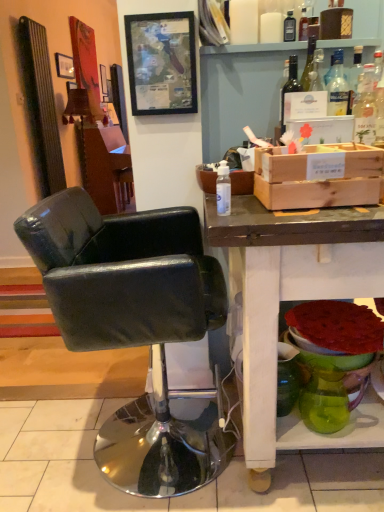
Question: Is wooden framed map at upper center, which is the first picture frame from front to back, to the right of wooden crate at right from the viewer's perspective?

Choices:
 (A) yes
 (B) no

Answer: (B)

Question: From the image's perspective, would you say wooden framed map at upper center, acting as the second picture frame starting from the left, is positioned over wooden crate at right?

Choices:
 (A) no
 (B) yes

Answer: (B)

Question: From the image's perspective, is wooden framed map at upper center, arranged as the 2th picture frame when viewed from the top, beneath wooden crate at right?

Choices:
 (A) no
 (B) yes

Answer: (A)

Question: Is the surface of wooden framed map at upper center, acting as the second picture frame starting from the left, in direct contact with wooden crate at right?

Choices:
 (A) yes
 (B) no

Answer: (B)

Question: Is there a large distance between wooden framed map at upper center, which appears as the 1th picture frame when viewed from the right, and wooden crate at right?

Choices:
 (A) no
 (B) yes

Answer: (A)

Question: From a real-world perspective, is wooden framed map at upper center, arranged as the 2th picture frame when viewed from the top, under wooden crate at right?

Choices:
 (A) no
 (B) yes

Answer: (A)

Question: Considering the relative sizes of transparent glass bottle at upper center, the 3th bottle from the bottom, and green glass vase at lower right in the image provided, is transparent glass bottle at upper center, the 3th bottle from the bottom, wider than green glass vase at lower right?

Choices:
 (A) no
 (B) yes

Answer: (A)

Question: Considering the relative sizes of transparent glass bottle at upper center, the 3th bottle from the bottom, and green glass vase at lower right in the image provided, is transparent glass bottle at upper center, the 3th bottle from the bottom, smaller than green glass vase at lower right?

Choices:
 (A) yes
 (B) no

Answer: (A)

Question: Is the position of transparent glass bottle at upper center, placed as the third bottle when sorted from left to right, less distant than that of green glass vase at lower right?

Choices:
 (A) yes
 (B) no

Answer: (B)

Question: Considering the relative sizes of transparent glass bottle at upper center, the 3th bottle from the bottom, and green glass vase at lower right in the image provided, is transparent glass bottle at upper center, the 3th bottle from the bottom, thinner than green glass vase at lower right?

Choices:
 (A) no
 (B) yes

Answer: (B)

Question: Can you confirm if transparent glass bottle at upper center, the third bottle viewed from the front, is taller than green glass vase at lower right?

Choices:
 (A) no
 (B) yes

Answer: (A)

Question: Is the depth of transparent glass bottle at upper center, positioned as the first bottle in top-to-bottom order, greater than that of green glass vase at lower right?

Choices:
 (A) no
 (B) yes

Answer: (B)

Question: Is translucent glass bottle at upper right, placed as the 2th bottle when sorted from right to left, bigger than green glass vase at lower right?

Choices:
 (A) no
 (B) yes

Answer: (A)